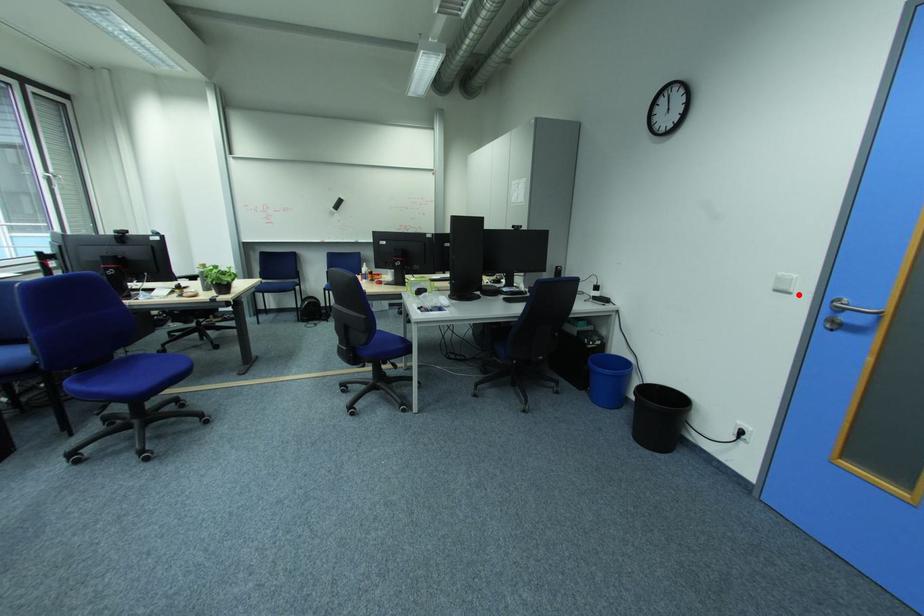
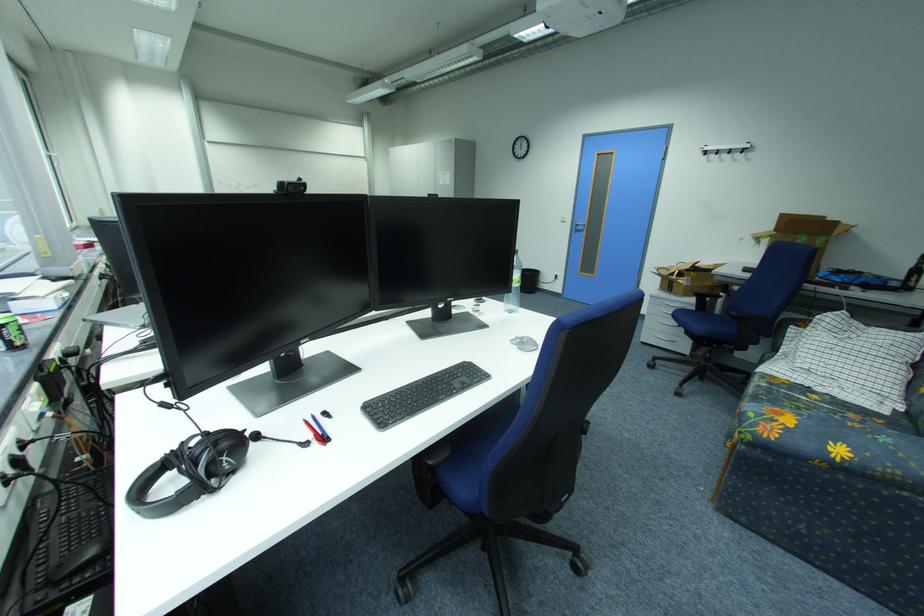
Question: I am providing you with two images of the same scene from different viewpoints. A red point is marked on the first image. Is the red point's position out of view in image 2?

Choices:
 (A) Yes
 (B) No

Answer: (B)